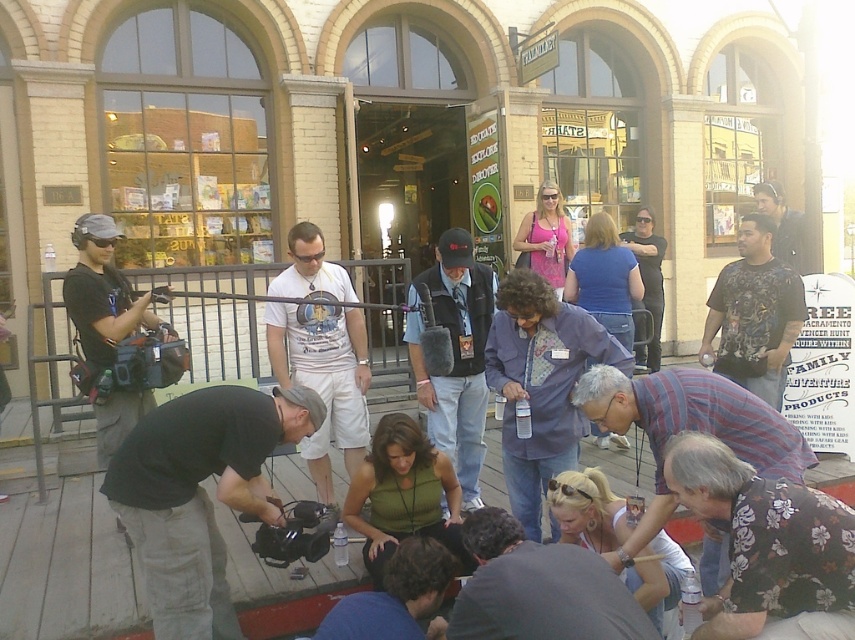
Can you confirm if black matte camera at lower left is wider than matte black camera at left?

Indeed, black matte camera at lower left has a greater width compared to matte black camera at left.

Who is shorter, black matte camera at lower left or matte black camera at left?

black matte camera at lower left is shorter.

Who is more forward, [172,548] or [116,230]?

Point [172,548] is in front.

Identify the location of black matte camera at lower left. This screenshot has height=640, width=855. (199, 493).

Can you confirm if white cotton t-shirt at center is wider than matte black shirt at center?

Incorrect, white cotton t-shirt at center's width does not surpass matte black shirt at center's.

Who is higher up, white cotton t-shirt at center or matte black shirt at center?

matte black shirt at center is higher up.

Who is more forward, [292,365] or [659,332]?

Positioned in front is point [292,365].

I want to click on white cotton t-shirt at center, so click(x=323, y=378).

Is dark gray shirt at lower center positioned before denim vest at center?

Yes.

The image size is (855, 640). Find the location of `dark gray shirt at lower center`. dark gray shirt at lower center is located at coordinates click(540, 588).